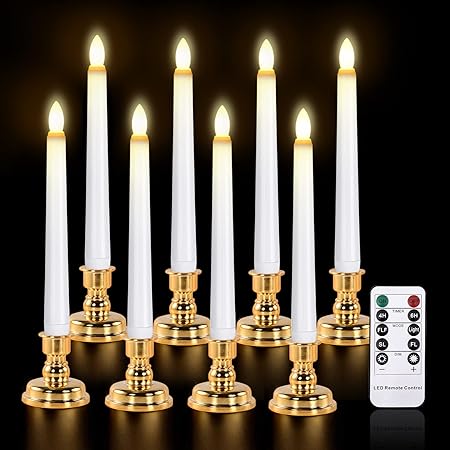
You are a GUI agent. You are given a task and a screenshot of the screen. Output one action in this format:
    pyautogui.click(x=<x>, y=<y>)
    Task: Click on the off button
    The width and height of the screenshot is (450, 450).
    Given the screenshot: What is the action you would take?
    pyautogui.click(x=410, y=300)